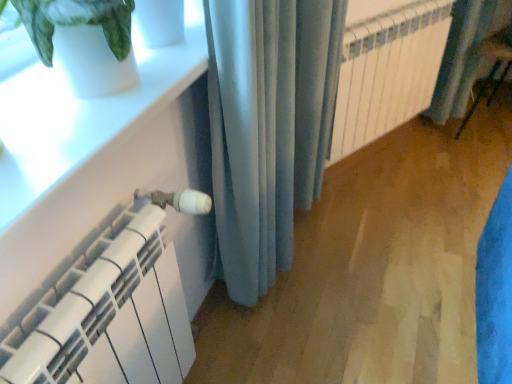
Find the location of a particular element. The image size is (512, 384). satin blue curtain at center, the second curtain in the back-to-front sequence is located at coordinates (268, 127).

At what (x,y) coordinates should I click in order to perform the action: click on blue fabric curtain at right, which is the 1th curtain from back to front. Please return your answer as a coordinate pair (x, y). Looking at the image, I should click on (464, 55).

Image resolution: width=512 pixels, height=384 pixels. Describe the element at coordinates (110, 313) in the screenshot. I see `white matte heater at lower left` at that location.

Where is `white glossy window sill at upper left`? white glossy window sill at upper left is located at coordinates (78, 116).

In order to click on satin blue curtain at center, the second curtain in the back-to-front sequence in this screenshot , I will do `click(268, 127)`.

Would you say blue fabric curtain at right, which is the 1th curtain from right to left, is inside or outside white metallic radiator at center?

blue fabric curtain at right, which is the 1th curtain from right to left, is not inside white metallic radiator at center, it's outside.

Which of these two, blue fabric curtain at right, marked as the 2th curtain in a front-to-back arrangement, or white metallic radiator at center, is wider?

Wider between the two is blue fabric curtain at right, marked as the 2th curtain in a front-to-back arrangement.

From the image's perspective, is blue fabric curtain at right, which is the 1th curtain from right to left, above white metallic radiator at center?

Indeed, from the image's perspective, blue fabric curtain at right, which is the 1th curtain from right to left, is shown above white metallic radiator at center.

How different are the orientations of white glossy window sill at upper left and white metallic radiator at center in degrees?

The angular difference between white glossy window sill at upper left and white metallic radiator at center is 29.9 degrees.

Is white glossy window sill at upper left at the left side of white metallic radiator at center?

Yes, white glossy window sill at upper left is to the left of white metallic radiator at center.

Which object is wider, white glossy window sill at upper left or white metallic radiator at center?

white glossy window sill at upper left.

Based on the photo, who is shorter, white glossy window sill at upper left or white metallic radiator at center?

Standing shorter between the two is white glossy window sill at upper left.

Is blue fabric curtain at right, which is the 1th curtain from right to left, thinner than white matte heater at lower left?

Incorrect, the width of blue fabric curtain at right, which is the 1th curtain from right to left, is not less than that of white matte heater at lower left.

From the image's perspective, is blue fabric curtain at right, which is the 2th curtain from left to right, under white matte heater at lower left?

No, from the image's perspective, blue fabric curtain at right, which is the 2th curtain from left to right, is not below white matte heater at lower left.

Is blue fabric curtain at right, marked as the 2th curtain in a front-to-back arrangement, facing away from white matte heater at lower left?

blue fabric curtain at right, marked as the 2th curtain in a front-to-back arrangement, is not turned away from white matte heater at lower left.

Considering the points (484, 27) and (123, 365), which point is behind, point (484, 27) or point (123, 365)?

The point (484, 27) is more distant.

Are white matte heater at lower left and white glossy window sill at upper left making contact?

white matte heater at lower left and white glossy window sill at upper left are clearly separated.

Considering the sizes of objects white matte heater at lower left and white glossy window sill at upper left in the image provided, who is thinner, white matte heater at lower left or white glossy window sill at upper left?

Thinner between the two is white matte heater at lower left.

Looking at this image, is white matte heater at lower left bigger or smaller than white glossy window sill at upper left?

In the image, white matte heater at lower left appears to be larger than white glossy window sill at upper left.

Considering the sizes of objects white matte heater at lower left and white metallic radiator at center in the image provided, who is taller, white matte heater at lower left or white metallic radiator at center?

Standing taller between the two is white metallic radiator at center.

Is the surface of white matte heater at lower left in direct contact with white metallic radiator at center?

white matte heater at lower left and white metallic radiator at center are clearly separated.

How different are the orientations of white matte heater at lower left and white metallic radiator at center in degrees?

29.9 degrees.

Locate an element on the screen. heater on the left of white metallic radiator at center is located at coordinates (110, 313).

Are white metallic radiator at center and satin blue curtain at center, the second curtain in the right-to-left sequence, located far from each other?

No, white metallic radiator at center is not far away from satin blue curtain at center, the second curtain in the right-to-left sequence.

Would you say white metallic radiator at center contains satin blue curtain at center, the second curtain in the back-to-front sequence?

No, white metallic radiator at center does not contain satin blue curtain at center, the second curtain in the back-to-front sequence.

At what (x,y) coordinates should I click in order to perform the action: click on radiator lying above the satin blue curtain at center, which appears as the first curtain when viewed from the left (from the image's perspective). Please return your answer as a coordinate pair (x, y). Looking at the image, I should click on (388, 72).

Measure the distance between white metallic radiator at center and white glossy window sill at upper left.

The distance of white metallic radiator at center from white glossy window sill at upper left is 3.65 feet.

From the picture: Is white metallic radiator at center positioned with its back to white glossy window sill at upper left?

No.

In terms of size, does white metallic radiator at center appear bigger or smaller than white glossy window sill at upper left?

In the image, white metallic radiator at center appears to be larger than white glossy window sill at upper left.

Is point (372, 35) positioned before point (144, 58)?

No, it is behind (144, 58).

Identify the location of radiator that is above the blue fabric curtain at right, marked as the 2th curtain in a front-to-back arrangement (from a real-world perspective). (388, 72).

You are a GUI agent. You are given a task and a screenshot of the screen. Output one action in this format:
    pyautogui.click(x=<x>, y=<y>)
    Task: Click on the radiator beneath the white glossy window sill at upper left (from a real-world perspective)
    The height and width of the screenshot is (384, 512).
    Given the screenshot: What is the action you would take?
    pyautogui.click(x=388, y=72)

Estimate the real-world distances between objects in this image. Which object is closer to white matte heater at lower left, white metallic radiator at center or satin blue curtain at center, the first curtain from the front?

satin blue curtain at center, the first curtain from the front, lies closer to white matte heater at lower left than the other object.

Estimate the real-world distances between objects in this image. Which object is further from satin blue curtain at center, the second curtain in the back-to-front sequence, blue fabric curtain at right, which is the 1th curtain from right to left, or white metallic radiator at center?

blue fabric curtain at right, which is the 1th curtain from right to left, is positioned further to the anchor satin blue curtain at center, the second curtain in the back-to-front sequence.

Estimate the real-world distances between objects in this image. Which object is further from white glossy window sill at upper left, white metallic radiator at center or blue fabric curtain at right, marked as the 2th curtain in a front-to-back arrangement?

The object further to white glossy window sill at upper left is blue fabric curtain at right, marked as the 2th curtain in a front-to-back arrangement.

Which object lies nearer to the anchor point white glossy window sill at upper left, white metallic radiator at center or white matte heater at lower left?

white matte heater at lower left.

Considering their positions, is white metallic radiator at center positioned further to white glossy window sill at upper left than satin blue curtain at center, the first curtain from the front?

Based on the image, white metallic radiator at center appears to be further to white glossy window sill at upper left.

From the image, which object appears to be nearer to satin blue curtain at center, the second curtain in the right-to-left sequence, white metallic radiator at center or white matte heater at lower left?

white matte heater at lower left lies closer to satin blue curtain at center, the second curtain in the right-to-left sequence, than the other object.

Estimate the real-world distances between objects in this image. Which object is closer to white metallic radiator at center, white matte heater at lower left or white glossy window sill at upper left?

white glossy window sill at upper left.

Estimate the real-world distances between objects in this image. Which object is closer to blue fabric curtain at right, which is the 2th curtain from left to right, white metallic radiator at center or satin blue curtain at center, the second curtain in the right-to-left sequence?

white metallic radiator at center is positioned closer to the anchor blue fabric curtain at right, which is the 2th curtain from left to right.

Identify the location of heater positioned between white glossy window sill at upper left and white metallic radiator at center from near to far. This screenshot has height=384, width=512. (110, 313).

At what (x,y) coordinates should I click in order to perform the action: click on radiator between satin blue curtain at center, which appears as the first curtain when viewed from the left, and blue fabric curtain at right, marked as the 2th curtain in a front-to-back arrangement, from left to right. Please return your answer as a coordinate pair (x, y). Image resolution: width=512 pixels, height=384 pixels. Looking at the image, I should click on (388, 72).

This screenshot has width=512, height=384. Find the location of `curtain between white glossy window sill at upper left and blue fabric curtain at right, which is the 1th curtain from back to front, from left to right`. curtain between white glossy window sill at upper left and blue fabric curtain at right, which is the 1th curtain from back to front, from left to right is located at coordinates (268, 127).

Identify the location of curtain between white matte heater at lower left and blue fabric curtain at right, which is the 2th curtain from left to right. The image size is (512, 384). (268, 127).